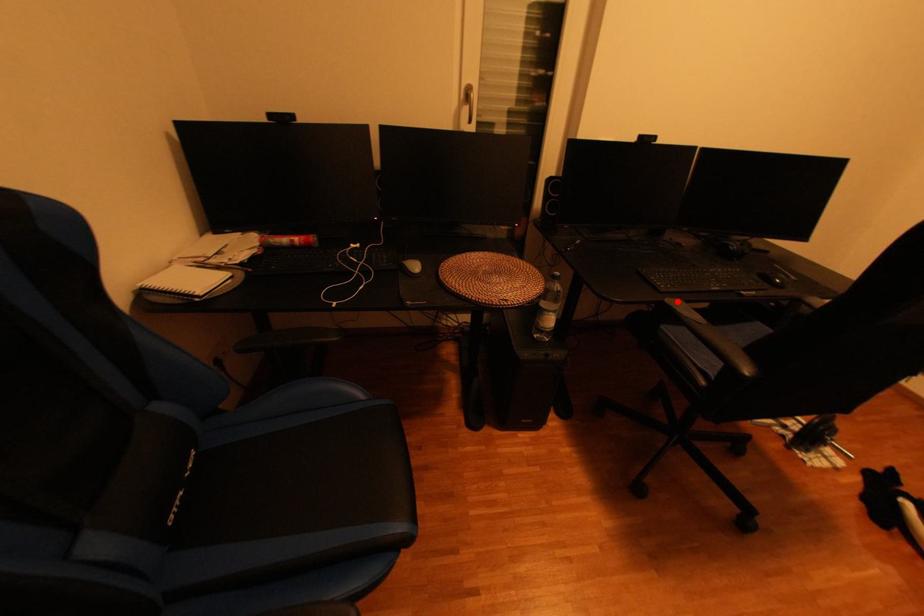
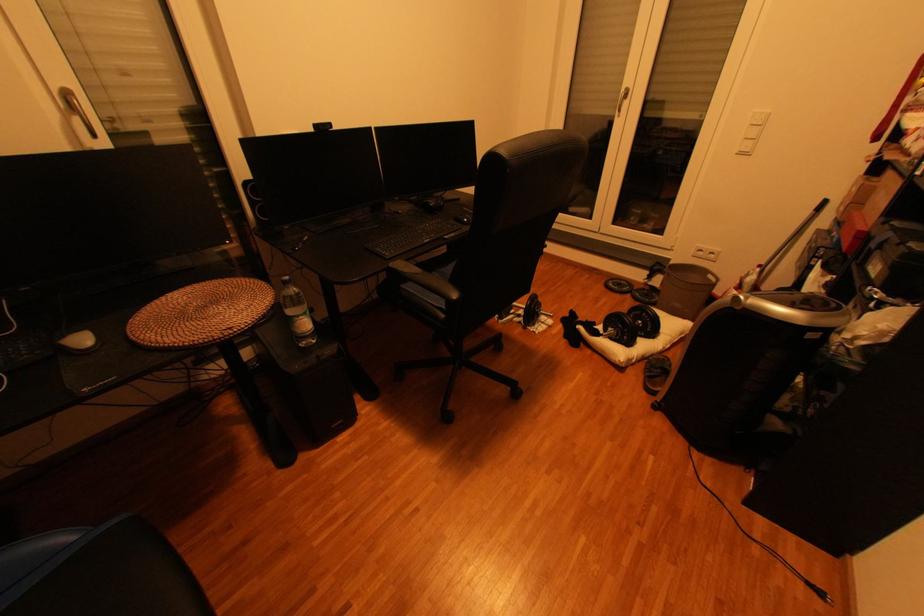
Locate, in the second image, the point that corresponds to the highlighted location in the first image.

(400, 265)